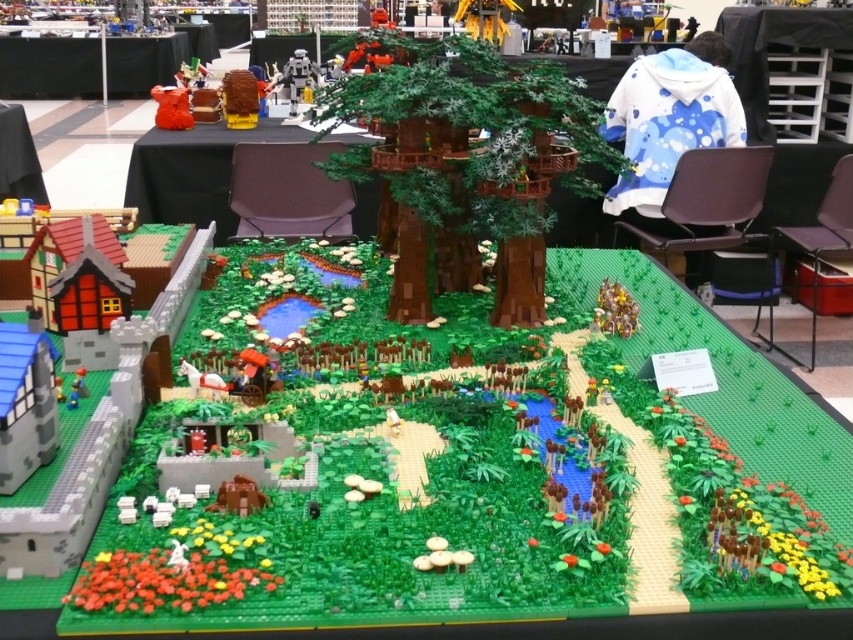
Question: Estimate the real-world distances between objects in this image. Which object is closer to the green matte tree at center?

Choices:
 (A) smooth plastic table at lower left
 (B) green matte table at center
 (C) black plastic table at upper left

Answer: (B)

Question: Is green matte table at center positioned before black plastic table at upper left?

Choices:
 (A) no
 (B) yes

Answer: (B)

Question: From the image, what is the correct spatial relationship of black plastic table at upper left in relation to smooth plastic table at lower left?

Choices:
 (A) below
 (B) above

Answer: (B)

Question: Does black plastic table at upper left appear on the left side of smooth plastic table at lower left?

Choices:
 (A) no
 (B) yes

Answer: (B)

Question: Estimate the real-world distances between objects in this image. Which object is farther from the green matte table at center?

Choices:
 (A) black plastic table at upper left
 (B) smooth plastic table at lower left
 (C) green matte tree at center

Answer: (A)

Question: Which of the following is the farthest from the observer?

Choices:
 (A) (251, 140)
 (B) (35, 166)

Answer: (B)